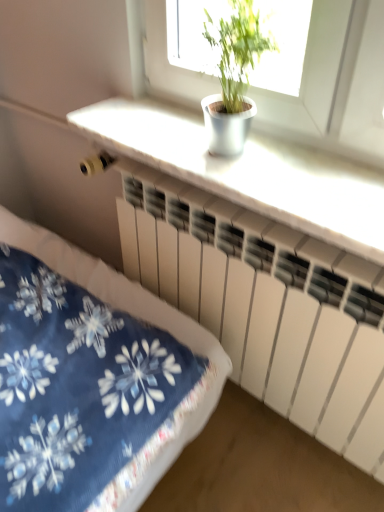
Question: Relative to green leafy plant at upper center, is white matte counter top at upper center in front or behind?

Choices:
 (A) front
 (B) behind

Answer: (B)

Question: Is white matte counter top at upper center taller or shorter than green leafy plant at upper center?

Choices:
 (A) short
 (B) tall

Answer: (A)

Question: Estimate the real-world distances between objects in this image. Which object is closer to the white matte counter top at upper center?

Choices:
 (A) white matte radiator at center
 (B) green leafy plant at upper center

Answer: (B)

Question: Which is nearer to the white matte radiator at center?

Choices:
 (A) green leafy plant at upper center
 (B) white matte counter top at upper center

Answer: (B)